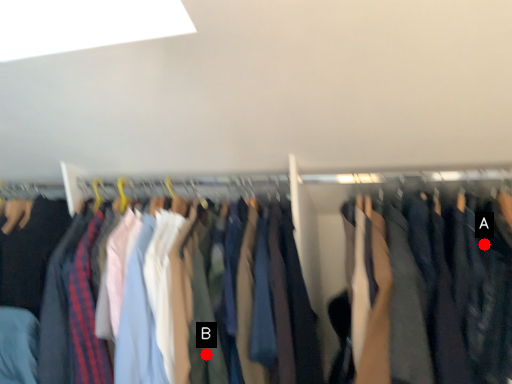
Question: Two points are circled on the image, labeled by A and B beside each circle. Which point is farther to the camera?

Choices:
 (A) A is further
 (B) B is further

Answer: (B)